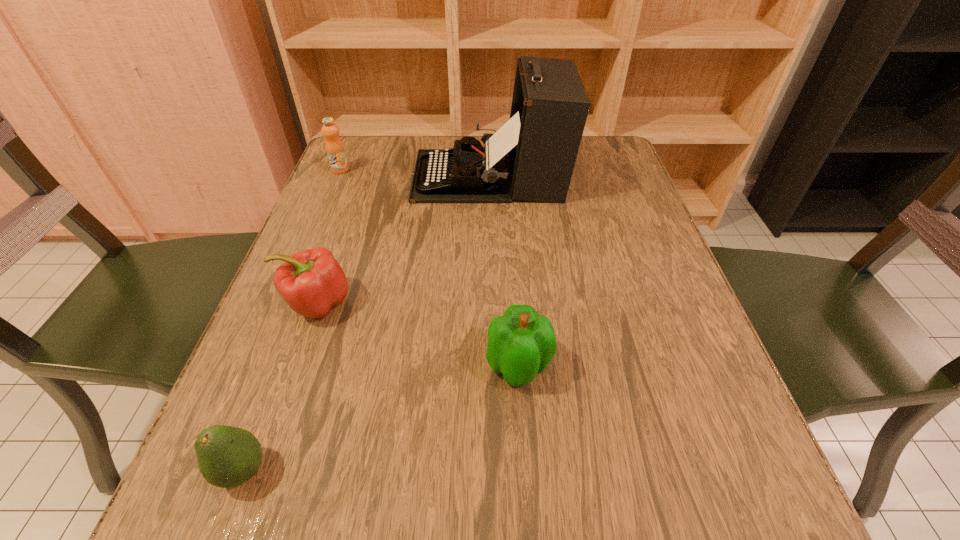
Identify the location of typewriter. (531, 157).

Where is `orange juice`? orange juice is located at coordinates (334, 147).

Locate an element on the screen. This screenshot has height=540, width=960. the fourth farthest object is located at coordinates (521, 343).

You are a GUI agent. You are given a task and a screenshot of the screen. Output one action in this format:
    pyautogui.click(x=<x>, y=<y>)
    Task: Click on the right bell pepper
    The image size is (960, 540).
    Given the screenshot: What is the action you would take?
    pyautogui.click(x=521, y=343)

In order to click on the farther bell pepper in this screenshot , I will do `click(311, 282)`.

What are the coordinates of `the third nearest object` in the screenshot? It's located at (311, 282).

Identify the location of avocado. The width and height of the screenshot is (960, 540). (227, 456).

Locate an element on the screen. The image size is (960, 540). free space located inside the open case of the typewriter is located at coordinates (365, 176).

Locate an element on the screen. free location located inside the open case of the typewriter is located at coordinates (328, 176).

Find the location of `free space located inside the open case of the typewriter`. free space located inside the open case of the typewriter is located at coordinates (360, 176).